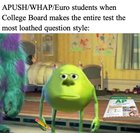
Identify the location of table. The width and height of the screenshot is (140, 133). (28, 112).